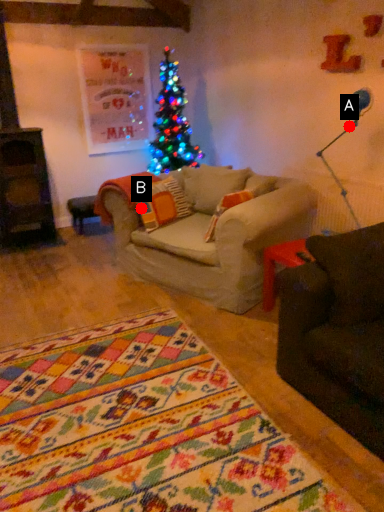
Question: Two points are circled on the image, labeled by A and B beside each circle. Which point is closer to the camera taking this photo?

Choices:
 (A) A is closer
 (B) B is closer

Answer: (A)